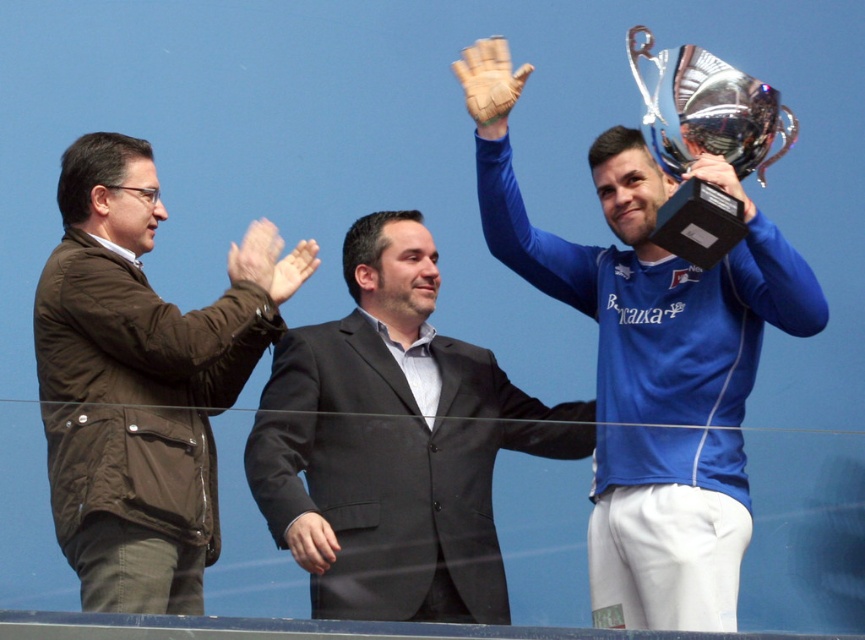
Can you confirm if silver metallic trophy at upper right is shorter than matte brown glove at upper center?

Incorrect, silver metallic trophy at upper right's height does not fall short of matte brown glove at upper center's.

Who is more forward, (651, 35) or (261, 260)?

Point (261, 260)

Where is `silver metallic trophy at upper right`? Image resolution: width=865 pixels, height=640 pixels. silver metallic trophy at upper right is located at coordinates (707, 108).

Is metallic trophy at upper right bigger than silver metallic trophy at upper right?

Yes.

Describe the element at coordinates (658, 380) in the screenshot. I see `metallic trophy at upper right` at that location.

Where is `metallic trophy at upper right`? Image resolution: width=865 pixels, height=640 pixels. metallic trophy at upper right is located at coordinates coord(658,380).

Is point (601, 497) positioned after point (713, 163)?

No.

Between point (689, 432) and point (747, 204), which one is positioned behind?

Positioned behind is point (747, 204).

Describe the element at coordinates (658, 380) in the screenshot. The height and width of the screenshot is (640, 865). I see `metallic trophy at upper right` at that location.

You are a GUI agent. You are given a task and a screenshot of the screen. Output one action in this format:
    pyautogui.click(x=<x>, y=<y>)
    Task: Click on the metallic trophy at upper right
    The image size is (865, 640).
    Given the screenshot: What is the action you would take?
    pyautogui.click(x=658, y=380)